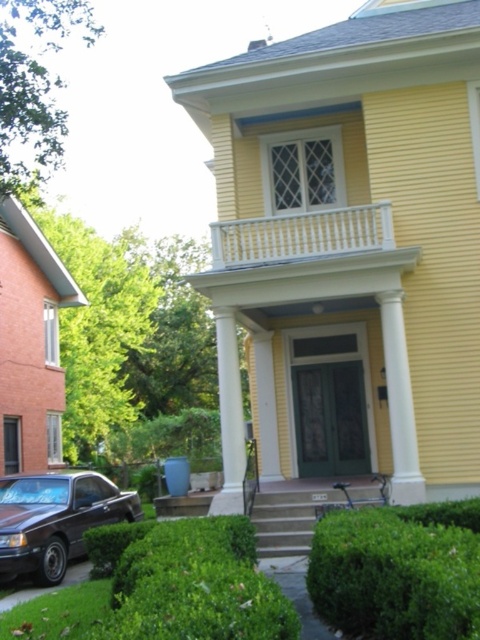
Based on the photo, you are planning to park your new car, which is the same size as the shiny brown car at lower left, in front of the house. The space available is marked by the white painted wood railing at upper center. Can your car fit in that space?

The shiny brown car at lower left is larger than the white painted wood railing at upper center. Since your car is the same size as the shiny brown car at lower left, it may not fit in the space marked by the white painted wood railing at upper center as the railing is smaller in size.

You are a delivery person approaching the house and need to park your vehicle. The driveway has a shiny brown car at lower left and a green leafy hedge at lower right. Which parking spot is more spacious for a larger delivery truck?

→ The green leafy hedge at lower right is larger in size than the shiny brown car at lower left, so the parking spot near the shiny brown car at lower left would be more spacious for a larger delivery truck since the hedge is bigger and might block more space.